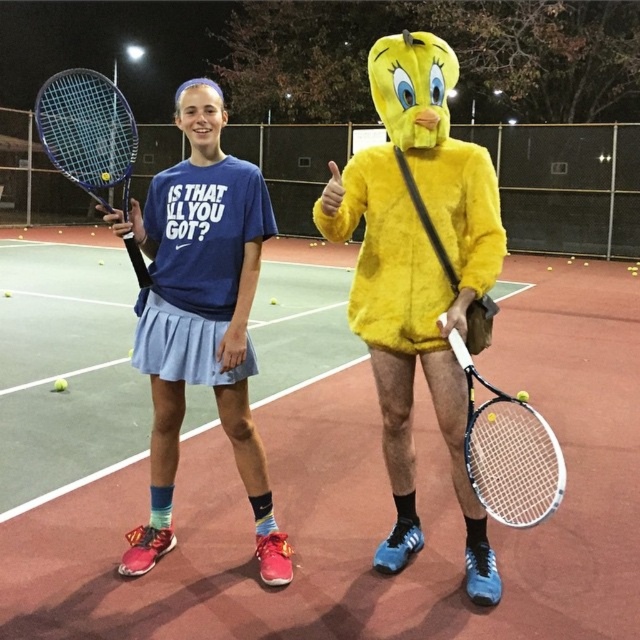
Is point (307, 632) positioned before point (160, 284)?

That is True.

The image size is (640, 640). What do you see at coordinates (371, 506) in the screenshot?
I see `green synthetic turf at center` at bounding box center [371, 506].

Describe the element at coordinates (371, 506) in the screenshot. This screenshot has height=640, width=640. I see `green synthetic turf at center` at that location.

This screenshot has width=640, height=640. What are the coordinates of `green synthetic turf at center` in the screenshot? It's located at (371, 506).

Is green synthetic turf at center shorter than blue matte tennis racket at left?

Yes.

Is point (68, 493) positioned behind point (145, 273)?

That is True.

The image size is (640, 640). In order to click on green synthetic turf at center in this screenshot , I will do `click(371, 506)`.

Does matte blue skirt at center appear over white matte tennis racket at center?

Correct, matte blue skirt at center is located above white matte tennis racket at center.

Describe the element at coordinates (200, 317) in the screenshot. The height and width of the screenshot is (640, 640). I see `matte blue skirt at center` at that location.

The image size is (640, 640). I want to click on matte blue skirt at center, so click(200, 317).